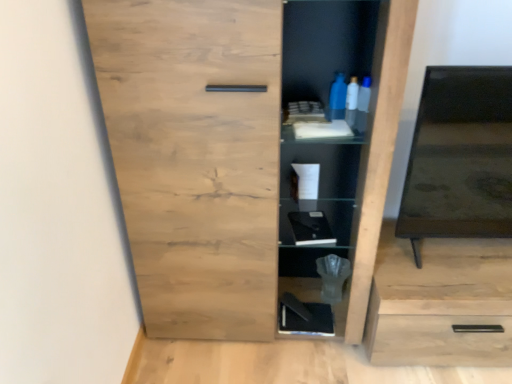
Question: From a real-world perspective, is black matte book at lower center, acting as the 2th cabinet starting from the top, located higher than light wood drawer at lower right?

Choices:
 (A) yes
 (B) no

Answer: (B)

Question: Can you confirm if black matte book at lower center, acting as the 2th cabinet starting from the top, is shorter than light wood drawer at lower right?

Choices:
 (A) no
 (B) yes

Answer: (B)

Question: Is the depth of black matte book at lower center, the second cabinet when ordered from front to back, greater than that of light wood drawer at lower right?

Choices:
 (A) no
 (B) yes

Answer: (B)

Question: Could you tell me if black matte book at lower center, arranged as the 1th cabinet when ordered from the bottom, is turned towards light wood drawer at lower right?

Choices:
 (A) yes
 (B) no

Answer: (B)

Question: Is black matte book at lower center, acting as the 2th cabinet starting from the top, positioned with its back to light wood drawer at lower right?

Choices:
 (A) yes
 (B) no

Answer: (B)

Question: Considering the relative positions of black matte book at lower center, arranged as the 1th cabinet when ordered from the bottom, and light wood drawer at lower right in the image provided, is black matte book at lower center, arranged as the 1th cabinet when ordered from the bottom, to the right of light wood drawer at lower right from the viewer's perspective?

Choices:
 (A) yes
 (B) no

Answer: (B)

Question: Considering the relative sizes of natural wood cupboard at center and black glossy tv at right in the image provided, is natural wood cupboard at center taller than black glossy tv at right?

Choices:
 (A) no
 (B) yes

Answer: (B)

Question: Is natural wood cupboard at center looking in the opposite direction of black glossy tv at right?

Choices:
 (A) no
 (B) yes

Answer: (A)

Question: Is natural wood cupboard at center located outside black glossy tv at right?

Choices:
 (A) yes
 (B) no

Answer: (A)

Question: Is natural wood cupboard at center at the left side of black glossy tv at right?

Choices:
 (A) yes
 (B) no

Answer: (A)

Question: From a real-world perspective, does natural wood cupboard at center sit lower than black glossy tv at right?

Choices:
 (A) yes
 (B) no

Answer: (A)

Question: Is natural wood cupboard at center thinner than black glossy tv at right?

Choices:
 (A) yes
 (B) no

Answer: (B)

Question: Does black glossy tv at right appear on the left side of natural wood cupboard at center?

Choices:
 (A) no
 (B) yes

Answer: (A)